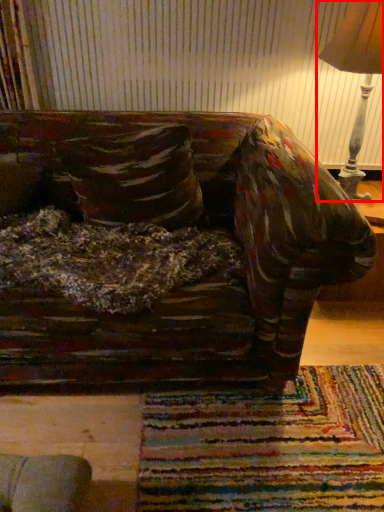
Question: Observing the image, what is the correct spatial positioning of lamp (annotated by the red box) in reference to throw pillow?

Choices:
 (A) left
 (B) right

Answer: (B)